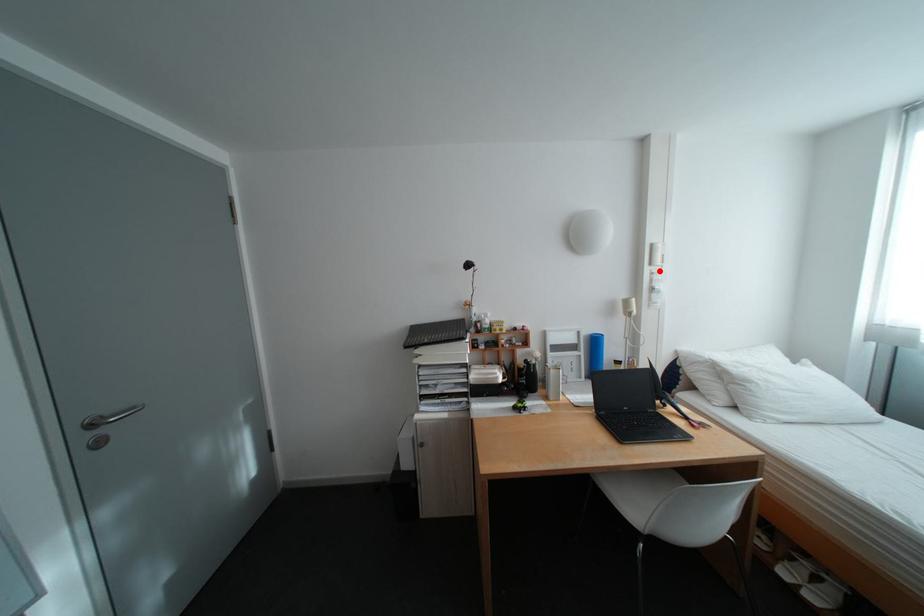
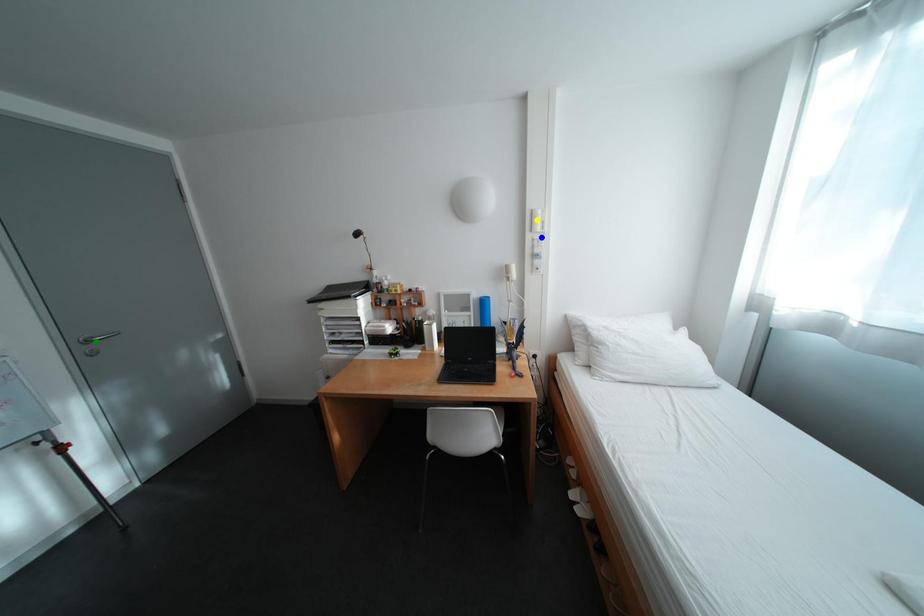
Question: I am providing you with two images of the same scene from different viewpoints. A red point is marked on the first image. You are given multiple points on the second image. Which point in image 2 is actually the same real-world point as the red point in image 1?

Choices:
 (A) green point
 (B) yellow point
 (C) blue point

Answer: (C)